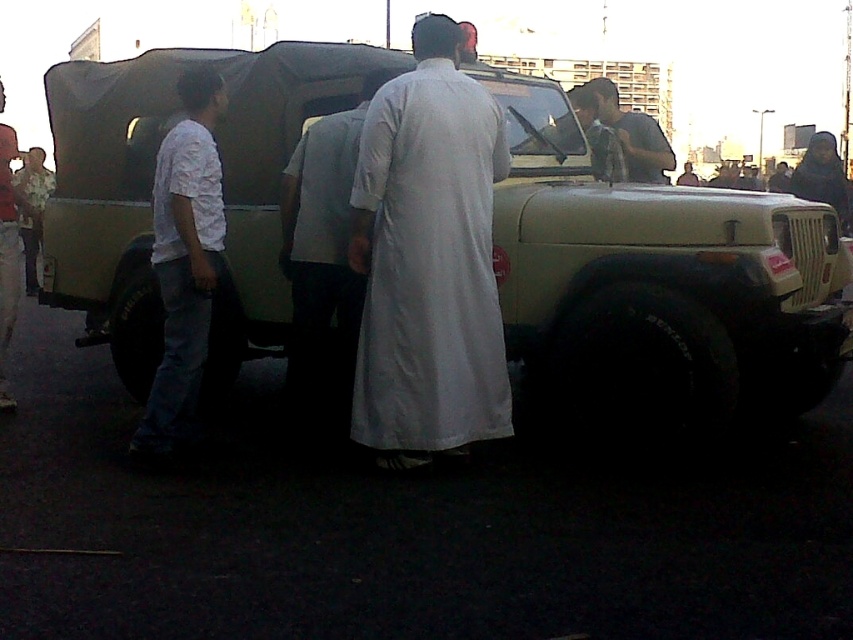
The width and height of the screenshot is (853, 640). Describe the element at coordinates (654, 292) in the screenshot. I see `matte khaki jeep at center` at that location.

Is point (576, 164) behind point (10, 400)?

Yes, it is.

Locate an element on the screen. The image size is (853, 640). matte khaki jeep at center is located at coordinates (654, 292).

Where is `matte khaki jeep at center`? The width and height of the screenshot is (853, 640). matte khaki jeep at center is located at coordinates (654, 292).

Looking at this image, is white cotton robe at center closer to camera compared to white matte robe at center?

Yes, white cotton robe at center is closer to the viewer.

Who is lower down, white cotton robe at center or white matte robe at center?

white matte robe at center

What do you see at coordinates (430, 266) in the screenshot? I see `white cotton robe at center` at bounding box center [430, 266].

At what (x,y) coordinates should I click in order to perform the action: click on white cotton robe at center. Please return your answer as a coordinate pair (x, y). The width and height of the screenshot is (853, 640). Looking at the image, I should click on (430, 266).

Locate an element on the screen. This screenshot has height=640, width=853. white cotton robe at center is located at coordinates (430, 266).

The height and width of the screenshot is (640, 853). What are the coordinates of `white cotton robe at center` in the screenshot? It's located at (430, 266).